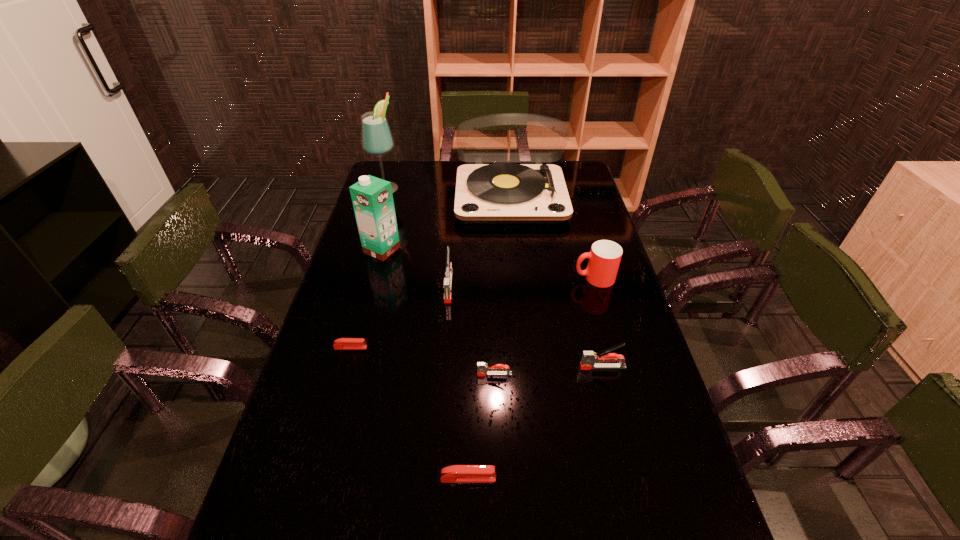
I want to click on alcohol that is at the far edge, so click(377, 140).

Where is `record player that is at the far edge`? The height and width of the screenshot is (540, 960). record player that is at the far edge is located at coordinates (500, 193).

Image resolution: width=960 pixels, height=540 pixels. In order to click on alcohol at the left edge in this screenshot , I will do `click(377, 140)`.

Locate an element on the screen. This screenshot has height=540, width=960. carton located in the left edge section of the desktop is located at coordinates (372, 198).

This screenshot has width=960, height=540. I want to click on stapler located in the left edge section of the desktop, so click(x=342, y=343).

This screenshot has width=960, height=540. In order to click on record player present at the right edge in this screenshot , I will do `click(500, 193)`.

This screenshot has width=960, height=540. Find the location of `cup positioned at the right edge`. cup positioned at the right edge is located at coordinates (x=604, y=258).

What are the coordinates of `stapler at the right edge` in the screenshot? It's located at (588, 360).

The width and height of the screenshot is (960, 540). I want to click on object present at the far left corner, so click(x=377, y=140).

You are a GUI agent. You are given a task and a screenshot of the screen. Output one action in this format:
    pyautogui.click(x=<x>, y=<y>)
    Task: Click on the object that is at the far right corner
    Image resolution: width=960 pixels, height=540 pixels.
    Given the screenshot: What is the action you would take?
    pyautogui.click(x=500, y=193)